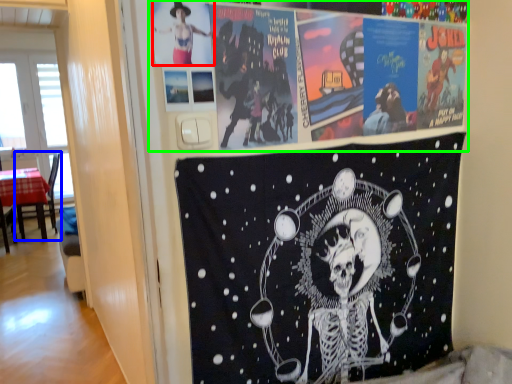
Question: Which object is positioned farthest from person (highlighted by a red box)? Select from chair (highlighted by a blue box) and poster (highlighted by a green box).

Choices:
 (A) chair
 (B) poster

Answer: (A)